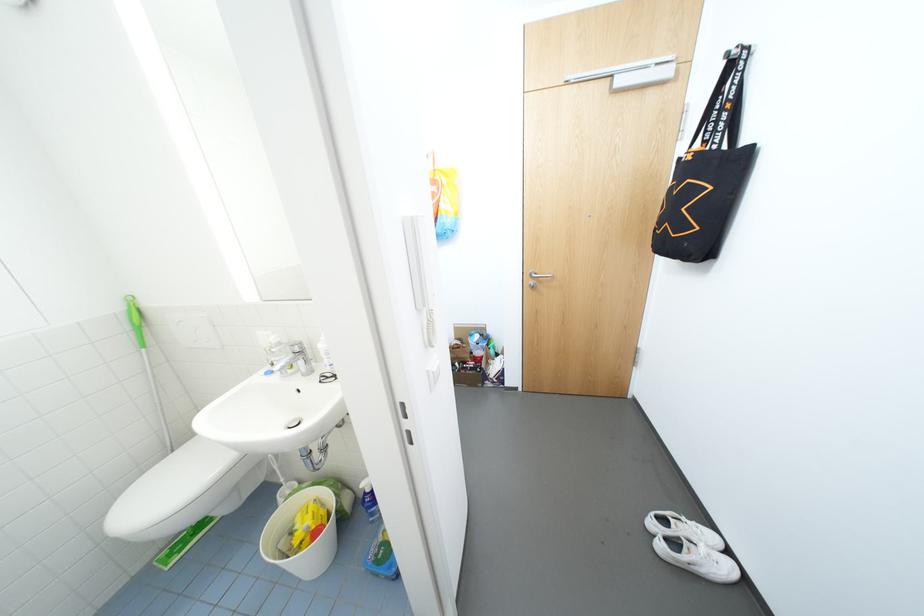
Which object does [698,560] point to?

It refers to a white shoe.